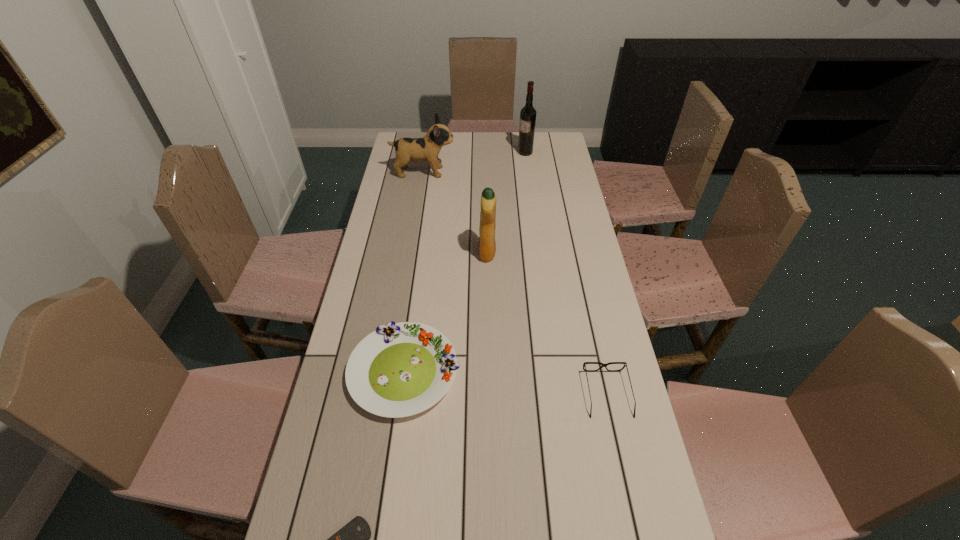
In order to click on vacant region between the wine bottle and the puppy in this screenshot , I will do `click(474, 163)`.

Find the location of a particular element. The width and height of the screenshot is (960, 540). free space between the third farthest object and the salad plate is located at coordinates (445, 313).

Where is `empty location between the detergent and the rightmost object`? This screenshot has width=960, height=540. empty location between the detergent and the rightmost object is located at coordinates (547, 323).

Identify which object is the third closest to the salad plate. Please provide its 2D coordinates. Your answer should be formatted as a tuple, i.e. [(x, y)], where the tuple contains the x and y coordinates of a point satisfying the conditions above.

[(625, 364)]

Locate which object is the second closest to the spectacles. Please provide its 2D coordinates. Your answer should be formatted as a tuple, i.e. [(x, y)], where the tuple contains the x and y coordinates of a point satisfying the conditions above.

[(487, 247)]